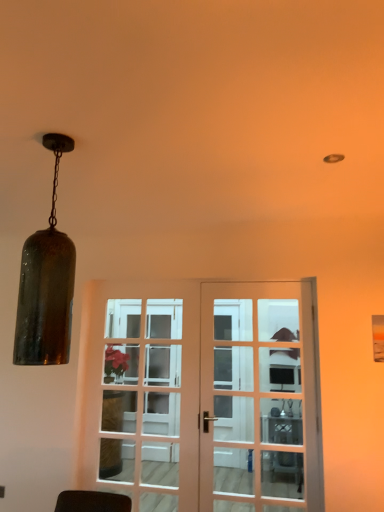
Locate an element on the screen. white glass screen door at center is located at coordinates (143, 399).

Measure the distance between point (51,138) and camera.

The distance of point (51,138) from camera is 1.79 meters.

Measure the distance between point [275,428] and camera.

A distance of 3.17 meters exists between point [275,428] and camera.

Find the location of a particular element. wooden glass door at center, which is the second door from right to left is located at coordinates (201, 394).

Looking at their sizes, would you say wooden glass door at center, arranged as the 1th door when viewed from the left, is wider or thinner than matte white door at center, marked as the second door in a left-to-right arrangement?

Clearly, wooden glass door at center, arranged as the 1th door when viewed from the left, has more width compared to matte white door at center, marked as the second door in a left-to-right arrangement.

Who is smaller, wooden glass door at center, which is the second door from right to left, or matte white door at center, marked as the second door in a left-to-right arrangement?

matte white door at center, marked as the second door in a left-to-right arrangement, is smaller.

Between point (286, 404) and point (205, 352), which one is positioned in front?

The point (286, 404) is closer to the camera.

Can you confirm if amber glass pendant light at left is positioned to the right of matte white door at center, which appears as the 1th door when viewed from the right?

Incorrect, amber glass pendant light at left is not on the right side of matte white door at center, which appears as the 1th door when viewed from the right.

Could you tell me if amber glass pendant light at left is turned towards matte white door at center, marked as the second door in a left-to-right arrangement?

No, amber glass pendant light at left is not facing towards matte white door at center, marked as the second door in a left-to-right arrangement.

Can you tell me how much amber glass pendant light at left and matte white door at center, which appears as the 1th door when viewed from the right, differ in facing direction?

86.7 degrees separate the facing orientations of amber glass pendant light at left and matte white door at center, which appears as the 1th door when viewed from the right.

Is matte white door at center, marked as the second door in a left-to-right arrangement, inside amber glass pendant light at left?

Definitely not — matte white door at center, marked as the second door in a left-to-right arrangement, is not inside amber glass pendant light at left.

Considering their positions, is matte white door at center, which appears as the 1th door when viewed from the right, located in front of or behind amber glass pendant light at left?

matte white door at center, which appears as the 1th door when viewed from the right, is behind amber glass pendant light at left.

Is matte white door at center, which appears as the 1th door when viewed from the right, oriented away from amber glass pendant light at left?

No, matte white door at center, which appears as the 1th door when viewed from the right, is not facing away from amber glass pendant light at left.

Is amber glass pendant light at left surrounded by matte white door at center, which appears as the 1th door when viewed from the right?

That's incorrect, amber glass pendant light at left is not inside matte white door at center, which appears as the 1th door when viewed from the right.

Which of these two, matte white door at center, marked as the second door in a left-to-right arrangement, or amber glass pendant light at left, stands taller?

matte white door at center, marked as the second door in a left-to-right arrangement, is taller.

Does white glass screen door at center have a greater width compared to metallic silver table at center?

Incorrect, the width of white glass screen door at center does not surpass that of metallic silver table at center.

Is metallic silver table at center located within white glass screen door at center?

No, white glass screen door at center does not contain metallic silver table at center.

Considering the relative sizes of white glass screen door at center and metallic silver table at center in the image provided, is white glass screen door at center shorter than metallic silver table at center?

No.

Considering the relative positions of white glass screen door at center and metallic silver table at center in the image provided, is white glass screen door at center in front of metallic silver table at center?

Yes, white glass screen door at center is in front of metallic silver table at center.

From the picture: Can you see wooden glass door at center, which is the second door from right to left, touching white glass screen door at center?

No, wooden glass door at center, which is the second door from right to left, is not next to white glass screen door at center.

Is wooden glass door at center, which is the second door from right to left, taller than white glass screen door at center?

Yes, wooden glass door at center, which is the second door from right to left, is taller than white glass screen door at center.

Is wooden glass door at center, which is the second door from right to left, spatially inside white glass screen door at center, or outside of it?

wooden glass door at center, which is the second door from right to left, is not inside white glass screen door at center, it's outside.

From the image's perspective, which object appears higher, wooden glass door at center, which is the second door from right to left, or white glass screen door at center?

white glass screen door at center.

Can you confirm if amber glass pendant light at left is bigger than wooden glass door at center, arranged as the 1th door when viewed from the left?

No.

Is amber glass pendant light at left with wooden glass door at center, which is the second door from right to left?

No.

From the picture: In terms of width, does amber glass pendant light at left look wider or thinner when compared to wooden glass door at center, which is the second door from right to left?

amber glass pendant light at left is wider than wooden glass door at center, which is the second door from right to left.

Is point (57, 162) closer or farther from the camera than point (240, 307)?

Point (57, 162) is positioned closer to the camera compared to point (240, 307).

Between matte white door at center, marked as the second door in a left-to-right arrangement, and metallic silver table at center, which one is positioned behind?

metallic silver table at center.

From a real-world perspective, is matte white door at center, marked as the second door in a left-to-right arrangement, positioned under metallic silver table at center based on gravity?

Actually, matte white door at center, marked as the second door in a left-to-right arrangement, is physically above metallic silver table at center in the real world.

Is matte white door at center, marked as the second door in a left-to-right arrangement, turned away from metallic silver table at center?

Absolutely, matte white door at center, marked as the second door in a left-to-right arrangement, is directed away from metallic silver table at center.

Is matte white door at center, marked as the second door in a left-to-right arrangement, at the left side of metallic silver table at center?

Indeed, matte white door at center, marked as the second door in a left-to-right arrangement, is positioned on the left side of metallic silver table at center.

Find the location of a particular element. This screenshot has width=384, height=512. door above the wooden glass door at center, which is the second door from right to left (from a real-world perspective) is located at coordinates (258, 398).

From the image's perspective, starting from the amber glass pendant light at left, which door is the 1st one below? Please provide its 2D coordinates.

[(258, 398)]

From the image, which object appears to be farther from metallic silver table at center, wooden glass door at center, arranged as the 1th door when viewed from the left, or white glass screen door at center?

Among the two, white glass screen door at center is located further to metallic silver table at center.

Looking at the image, which one is located further to wooden glass door at center, arranged as the 1th door when viewed from the left, metallic silver table at center or amber glass pendant light at left?

amber glass pendant light at left is further to wooden glass door at center, arranged as the 1th door when viewed from the left.

Looking at the image, which one is located closer to white glass screen door at center, matte white door at center, marked as the second door in a left-to-right arrangement, or amber glass pendant light at left?

Among the two, matte white door at center, marked as the second door in a left-to-right arrangement, is located nearer to white glass screen door at center.

Which object lies nearer to the anchor point metallic silver table at center, white glass screen door at center or amber glass pendant light at left?

The object closer to metallic silver table at center is white glass screen door at center.

From the image, which object appears to be farther from metallic silver table at center, amber glass pendant light at left or white glass screen door at center?

Among the two, amber glass pendant light at left is located further to metallic silver table at center.

Which object lies nearer to the anchor point white glass screen door at center, amber glass pendant light at left or metallic silver table at center?

metallic silver table at center is closer to white glass screen door at center.

In the scene shown: Considering their positions, is white glass screen door at center positioned further to wooden glass door at center, which is the second door from right to left, than matte white door at center, marked as the second door in a left-to-right arrangement?

white glass screen door at center.

When comparing their distances from matte white door at center, marked as the second door in a left-to-right arrangement, does wooden glass door at center, which is the second door from right to left, or amber glass pendant light at left seem further?

amber glass pendant light at left lies further to matte white door at center, marked as the second door in a left-to-right arrangement, than the other object.

Locate an element on the screen. screen door positioned between wooden glass door at center, arranged as the 1th door when viewed from the left, and metallic silver table at center from near to far is located at coordinates (143, 399).

Image resolution: width=384 pixels, height=512 pixels. I want to click on screen door between amber glass pendant light at left and metallic silver table at center in the front-back direction, so click(143, 399).

The image size is (384, 512). Identify the location of screen door between matte white door at center, marked as the second door in a left-to-right arrangement, and metallic silver table at center from front to back. (143, 399).

Image resolution: width=384 pixels, height=512 pixels. Identify the location of door located between white glass screen door at center and matte white door at center, which appears as the 1th door when viewed from the right, in the left-right direction. [x=201, y=394].